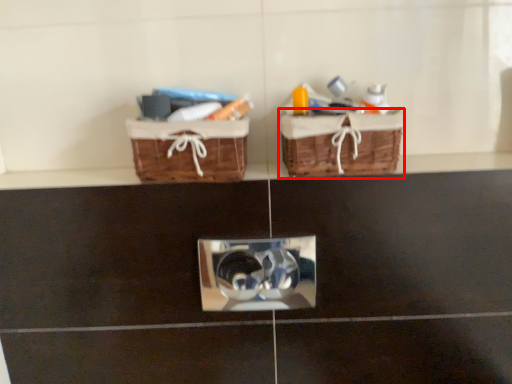
Question: From the image's perspective, what is the correct spatial positioning of picnic basket (annotated by the red box) in reference to picnic basket?

Choices:
 (A) above
 (B) below

Answer: (A)